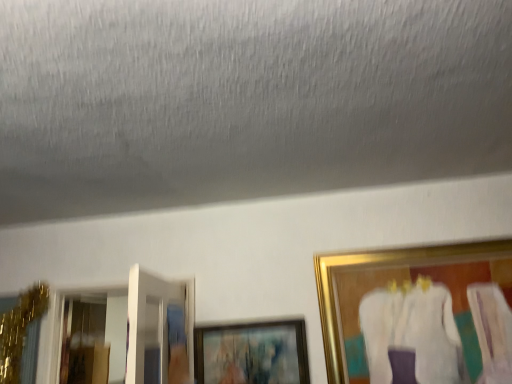
Question: Considering the relative sizes of gold-framed painting at right, positioned as the second picture frame in left-to-right order, and matte black picture frame at center, the first picture frame from the left, in the image provided, is gold-framed painting at right, positioned as the second picture frame in left-to-right order, shorter than matte black picture frame at center, the first picture frame from the left,?

Choices:
 (A) no
 (B) yes

Answer: (A)

Question: Is gold-framed painting at right, positioned as the second picture frame in left-to-right order, touching matte black picture frame at center, the first picture frame from the left?

Choices:
 (A) no
 (B) yes

Answer: (A)

Question: Can you confirm if gold-framed painting at right, which is the first picture frame from right to left, is wider than matte black picture frame at center, the first picture frame from the left?

Choices:
 (A) no
 (B) yes

Answer: (B)

Question: Is gold-framed painting at right, which is the first picture frame from right to left, to the left of matte black picture frame at center, the first picture frame from the left, from the viewer's perspective?

Choices:
 (A) no
 (B) yes

Answer: (A)

Question: From a real-world perspective, is gold-framed painting at right, which is the first picture frame from right to left, positioned over matte black picture frame at center, which ranks as the 2th picture frame in right-to-left order, based on gravity?

Choices:
 (A) no
 (B) yes

Answer: (B)

Question: From the image's perspective, is gold-framed painting at right, positioned as the second picture frame in left-to-right order, on matte black picture frame at center, which ranks as the 2th picture frame in right-to-left order?

Choices:
 (A) yes
 (B) no

Answer: (A)

Question: From the image's perspective, does matte black picture frame at center, the first picture frame from the left, appear lower than gold-framed painting at right, which is the first picture frame from right to left?

Choices:
 (A) yes
 (B) no

Answer: (A)

Question: Considering the relative sizes of matte black picture frame at center, the first picture frame from the left, and gold-framed painting at right, positioned as the second picture frame in left-to-right order, in the image provided, is matte black picture frame at center, the first picture frame from the left, wider than gold-framed painting at right, positioned as the second picture frame in left-to-right order,?

Choices:
 (A) no
 (B) yes

Answer: (A)

Question: Does matte black picture frame at center, the first picture frame from the left, have a greater height compared to gold-framed painting at right, which is the first picture frame from right to left?

Choices:
 (A) yes
 (B) no

Answer: (B)

Question: Is matte black picture frame at center, the first picture frame from the left, facing towards gold-framed painting at right, which is the first picture frame from right to left?

Choices:
 (A) yes
 (B) no

Answer: (B)

Question: From the image's perspective, is matte black picture frame at center, the first picture frame from the left, on gold-framed painting at right, which is the first picture frame from right to left?

Choices:
 (A) no
 (B) yes

Answer: (A)

Question: Can you confirm if matte black picture frame at center, which ranks as the 2th picture frame in right-to-left order, is positioned to the right of gold-framed painting at right, which is the first picture frame from right to left?

Choices:
 (A) yes
 (B) no

Answer: (B)

Question: Is gold-framed painting at right, positioned as the second picture frame in left-to-right order, inside the boundaries of matte black picture frame at center, which ranks as the 2th picture frame in right-to-left order, or outside?

Choices:
 (A) inside
 (B) outside

Answer: (B)